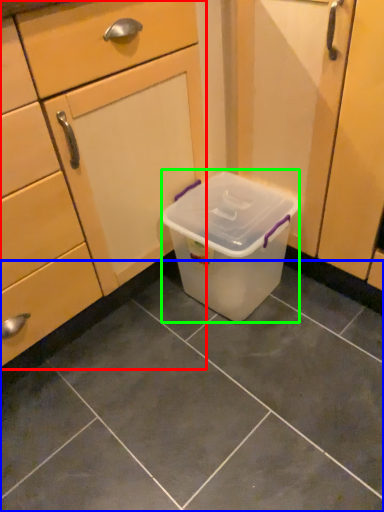
Question: Estimate the real-world distances between objects in this image. Which object is farther from cabinetry (highlighted by a red box), tile (highlighted by a blue box) or storage box (highlighted by a green box)?

Choices:
 (A) tile
 (B) storage box

Answer: (A)